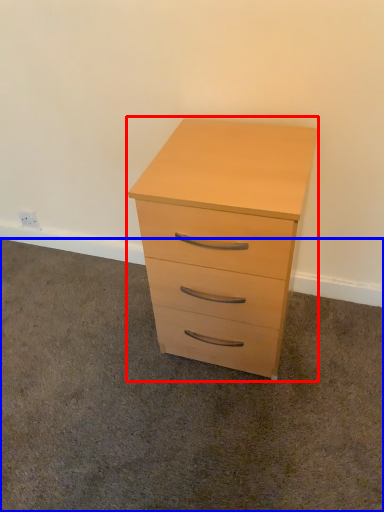
Question: Among these objects, which one is farthest to the camera, chest of drawers (highlighted by a red box) or plain (highlighted by a blue box)?

Choices:
 (A) chest of drawers
 (B) plain

Answer: (A)